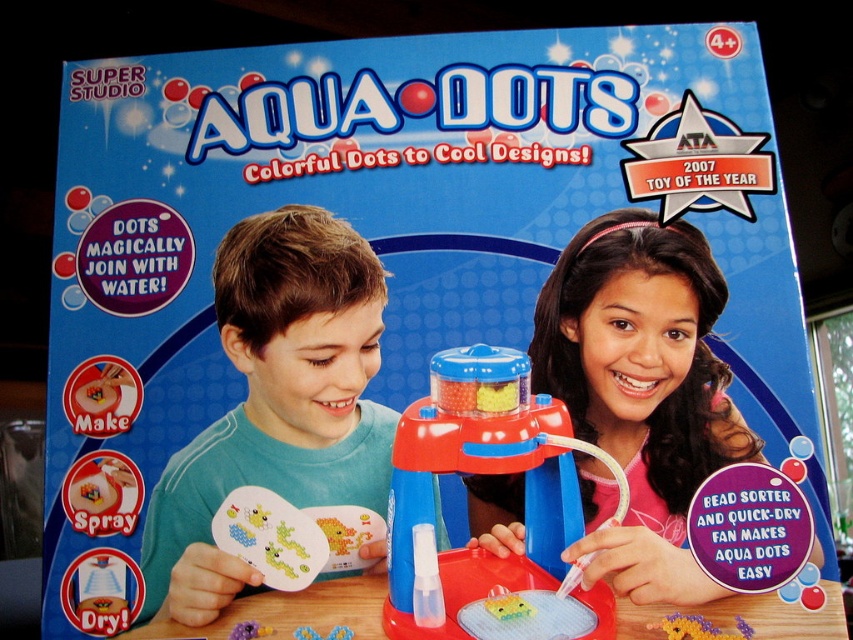
Can you confirm if pink fabric hairband at upper center is thinner than purple matte beads at center?

No, pink fabric hairband at upper center is not thinner than purple matte beads at center.

Is pink fabric hairband at upper center bigger than purple matte beads at center?

Indeed, pink fabric hairband at upper center has a larger size compared to purple matte beads at center.

Is point (699, 348) in front of point (238, 627)?

No, it is not.

I want to click on pink fabric hairband at upper center, so click(x=640, y=392).

Does point (398, 490) come in front of point (242, 630)?

Yes, it is.

Locate an element on the screen. Image resolution: width=853 pixels, height=640 pixels. blue plastic bead sorter at center is located at coordinates (496, 472).

Is point (741, 440) closer to camera compared to point (260, 256)?

Yes, it is in front of point (260, 256).

Who is more forward, (563,268) or (357,371)?

Positioned in front is point (357,371).

Locate an element on the screen. The image size is (853, 640). pink fabric hairband at upper center is located at coordinates (640, 392).